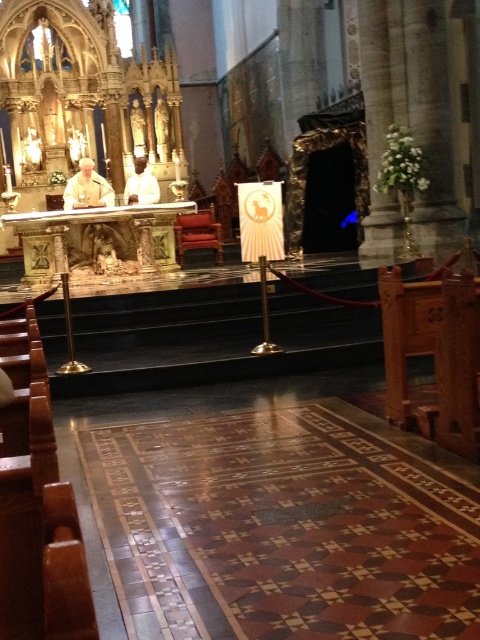
Consider the image. You are a photographer inside the cathedral and want to capture both the matte white robe at center and the white cloth at center in a single frame. Which object should you focus on first to ensure both are in the frame?

The matte white robe at center is smaller than the white cloth at center, so you should focus on the white cloth at center first to ensure both are in the frame.

You are an attendee at the cathedral service and want to hand a document to the priest wearing the matte white robe at center. There is also a white cloth at center nearby. Which object is closer to you so you can reach it first?

The matte white robe at center is closer to the viewer than the white cloth at center, so you can reach it first.